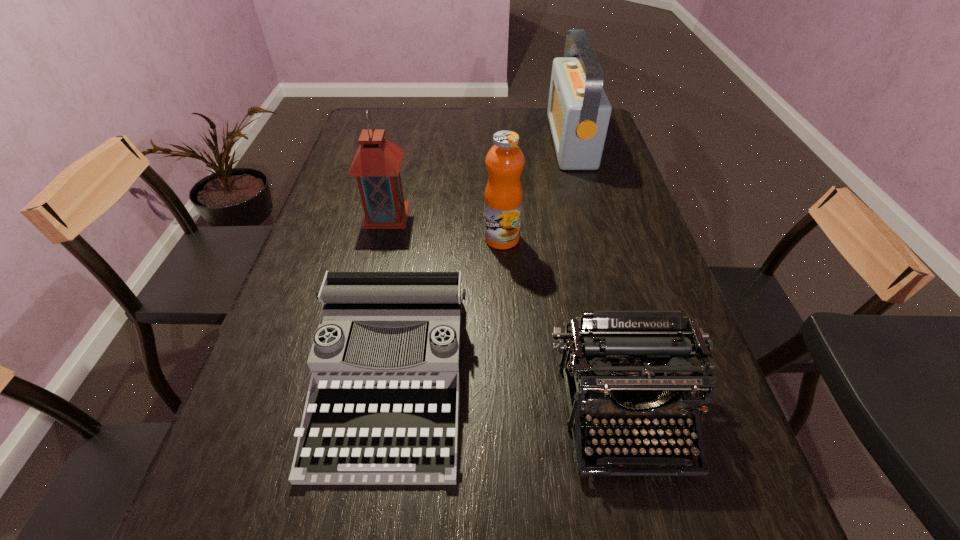
This screenshot has height=540, width=960. In order to click on free region at the far edge of the desktop in this screenshot , I will do `click(416, 124)`.

I want to click on free region at the left edge of the desktop, so click(x=331, y=182).

I want to click on vacant space at the right edge of the desktop, so pos(616,153).

In order to click on free space that is in between the farthest object and the taller typewriter in this screenshot , I will do `click(597, 279)`.

Where is `unoccupied position between the shorter typewriter and the taller typewriter`? The width and height of the screenshot is (960, 540). unoccupied position between the shorter typewriter and the taller typewriter is located at coordinates (508, 397).

Locate an element on the screen. Image resolution: width=960 pixels, height=540 pixels. vacant area between the farthest object and the lantern is located at coordinates (478, 178).

This screenshot has height=540, width=960. I want to click on vacant area between the farthest object and the fruit juice, so click(537, 190).

In order to click on unoccupied area between the lantern and the farthest object in this screenshot , I will do `click(478, 178)`.

I want to click on vacant space that is in between the lantern and the taller typewriter, so click(505, 315).

Where is `empty location between the shortest object and the taller typewriter`? The height and width of the screenshot is (540, 960). empty location between the shortest object and the taller typewriter is located at coordinates (508, 397).